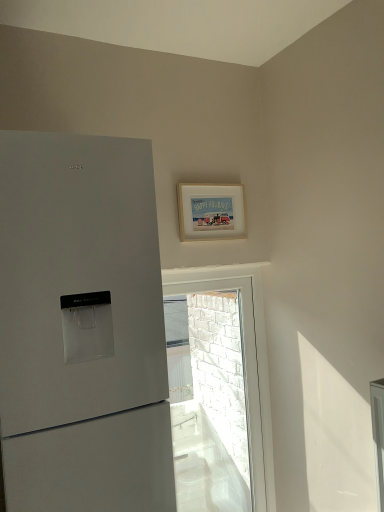
Measure the distance between point (257,291) and camera.

2.64 meters.

Where is `white brick wall at upper center`? The image size is (384, 512). white brick wall at upper center is located at coordinates (x=244, y=365).

Image resolution: width=384 pixels, height=512 pixels. What do you see at coordinates (244, 365) in the screenshot?
I see `white brick wall at upper center` at bounding box center [244, 365].

Locate an element on the screen. This screenshot has height=512, width=384. white matte picture frame at upper center is located at coordinates (211, 212).

What do you see at coordinates (211, 212) in the screenshot?
I see `white matte picture frame at upper center` at bounding box center [211, 212].

Where is `white brick wall at upper center`? white brick wall at upper center is located at coordinates (244, 365).

Between white matte picture frame at upper center and white brick wall at upper center, which one appears on the right side from the viewer's perspective?

white brick wall at upper center is more to the right.

Between white matte picture frame at upper center and white brick wall at upper center, which one is positioned in front?

white matte picture frame at upper center is closer to the camera.

In the scene shown: Which point is more distant from viewer, [207,224] or [246,377]?

The point [246,377] is farther from the camera.

From the image's perspective, is white matte picture frame at upper center located beneath white brick wall at upper center?

Incorrect, from the image's perspective, white matte picture frame at upper center is higher than white brick wall at upper center.

From a real-world perspective, is white matte picture frame at upper center physically below white brick wall at upper center?

No, from a real-world perspective, white matte picture frame at upper center is not beneath white brick wall at upper center.

Can you confirm if white matte picture frame at upper center is thinner than white brick wall at upper center?

Yes.

Who is shorter, white matte picture frame at upper center or white brick wall at upper center?

With less height is white matte picture frame at upper center.

Does white matte picture frame at upper center have a larger size compared to white brick wall at upper center?

No, white matte picture frame at upper center is not bigger than white brick wall at upper center.

Is white matte picture frame at upper center outside of white brick wall at upper center?

Yes, white matte picture frame at upper center is outside of white brick wall at upper center.

Is white matte picture frame at upper center not near white brick wall at upper center?

No, white matte picture frame at upper center is not far away from white brick wall at upper center.

Is white matte picture frame at upper center looking in the opposite direction of white brick wall at upper center?

That's not correct — white matte picture frame at upper center is not looking away from white brick wall at upper center.

I want to click on picture frame that appears above the white brick wall at upper center (from the image's perspective), so click(211, 212).

Which is more to the right, white brick wall at upper center or white matte picture frame at upper center?

Positioned to the right is white brick wall at upper center.

Is white brick wall at upper center in front of or behind white matte picture frame at upper center in the image?

In the image, white brick wall at upper center appears behind white matte picture frame at upper center.

Which is in front, point (229, 276) or point (186, 201)?

Point (186, 201)

From the image's perspective, is white brick wall at upper center above or below white matte picture frame at upper center?

white brick wall at upper center is situated lower than white matte picture frame at upper center in the image.

From a real-world perspective, between white brick wall at upper center and white matte picture frame at upper center, who is vertically lower?

white brick wall at upper center is physically lower.

Is white brick wall at upper center thinner than white matte picture frame at upper center?

Incorrect, the width of white brick wall at upper center is not less than that of white matte picture frame at upper center.

In terms of height, does white brick wall at upper center look taller or shorter compared to white matte picture frame at upper center?

Considering their sizes, white brick wall at upper center has more height than white matte picture frame at upper center.

Is white brick wall at upper center bigger or smaller than white matte picture frame at upper center?

Considering their sizes, white brick wall at upper center takes up more space than white matte picture frame at upper center.

Is white brick wall at upper center situated inside white matte picture frame at upper center or outside?

white brick wall at upper center cannot be found inside white matte picture frame at upper center.

Is there a large distance between white brick wall at upper center and white matte picture frame at upper center?

white brick wall at upper center is near white matte picture frame at upper center, not far away.

Is white brick wall at upper center aimed at white matte picture frame at upper center?

No, white brick wall at upper center is not turned towards white matte picture frame at upper center.

How distant is white brick wall at upper center from white matte picture frame at upper center?

The distance of white brick wall at upper center from white matte picture frame at upper center is 45.34 centimeters.

You are a GUI agent. You are given a task and a screenshot of the screen. Output one action in this format:
    pyautogui.click(x=<x>, y=<y>)
    Task: Click on the window below the white matte picture frame at upper center (from a real-world perspective)
    The image size is (384, 512).
    Given the screenshot: What is the action you would take?
    point(244,365)

This screenshot has width=384, height=512. What are the coordinates of `picture frame above the white brick wall at upper center (from a real-world perspective)` in the screenshot? It's located at (211, 212).

Find the location of `window below the white matte picture frame at upper center (from a real-world perspective)`. window below the white matte picture frame at upper center (from a real-world perspective) is located at coordinates (244, 365).